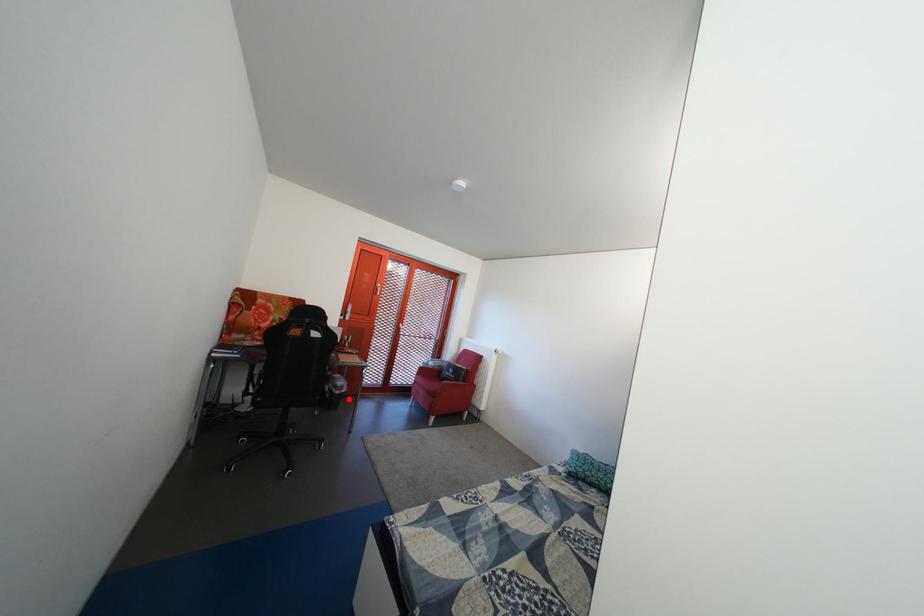
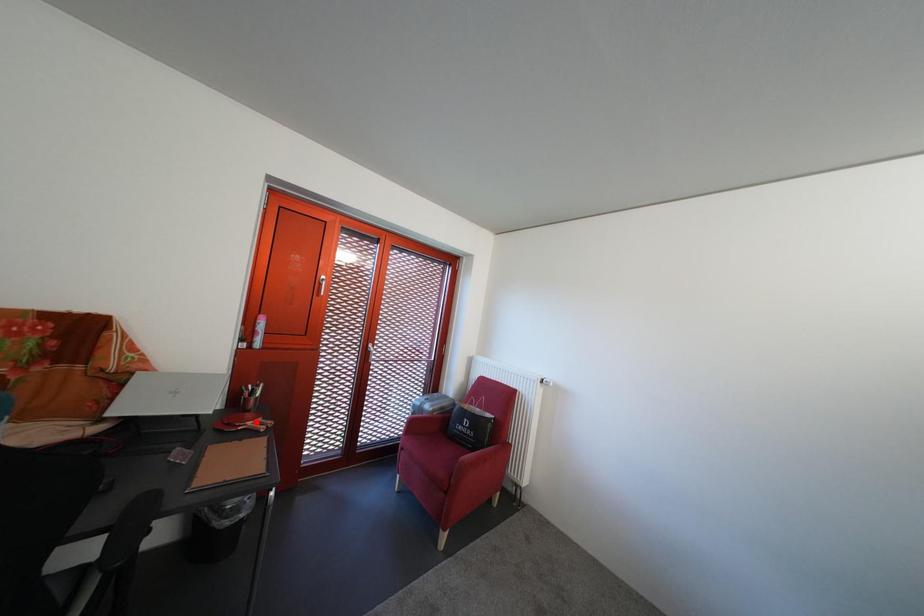
I am providing you with two images of the same scene from different viewpoints. A red point is marked on the first image and another point is marked on the second image. Is the marked point in image1 the same physical position as the marked point in image2?

No